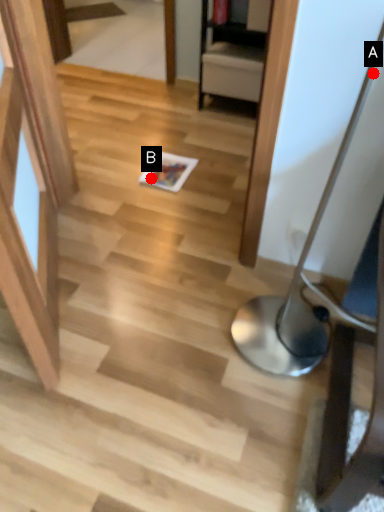
Question: Two points are circled on the image, labeled by A and B beside each circle. Which point is closer to the camera?

Choices:
 (A) A is closer
 (B) B is closer

Answer: (A)